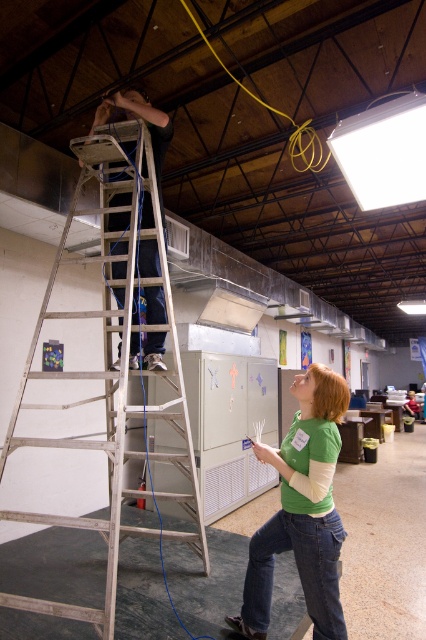
Can you confirm if green matte shirt at lower center is positioned to the right of matte black ladder at upper left?

Indeed, green matte shirt at lower center is positioned on the right side of matte black ladder at upper left.

Can you confirm if green matte shirt at lower center is smaller than matte black ladder at upper left?

Correct, green matte shirt at lower center occupies less space than matte black ladder at upper left.

Identify the location of green matte shirt at lower center. Image resolution: width=426 pixels, height=640 pixels. (302, 509).

Can you confirm if silver metallic ladder at upper left is smaller than green matte shirt at lower center?

Incorrect, silver metallic ladder at upper left is not smaller in size than green matte shirt at lower center.

Measure the distance between point (163, 273) and camera.

Point (163, 273) and camera are 3.31 meters apart from each other.

Image resolution: width=426 pixels, height=640 pixels. What are the coordinates of `silver metallic ladder at upper left` in the screenshot? It's located at (111, 369).

Measure the distance between point (x=106, y=172) and camera.

A distance of 3.58 meters exists between point (x=106, y=172) and camera.

The image size is (426, 640). I want to click on silver metallic ladder at upper left, so click(111, 369).

The width and height of the screenshot is (426, 640). Find the location of `silver metallic ladder at upper left`. silver metallic ladder at upper left is located at coordinates (111, 369).